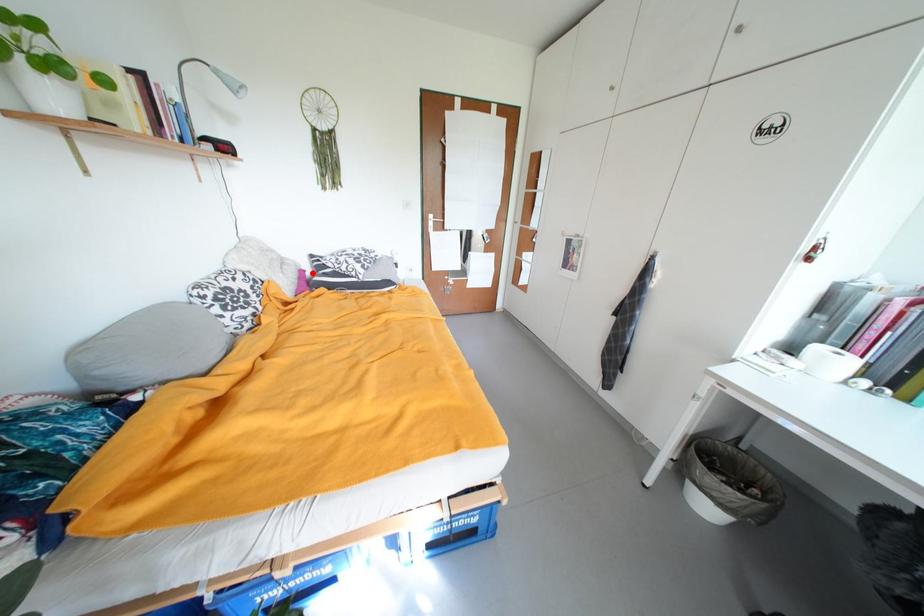
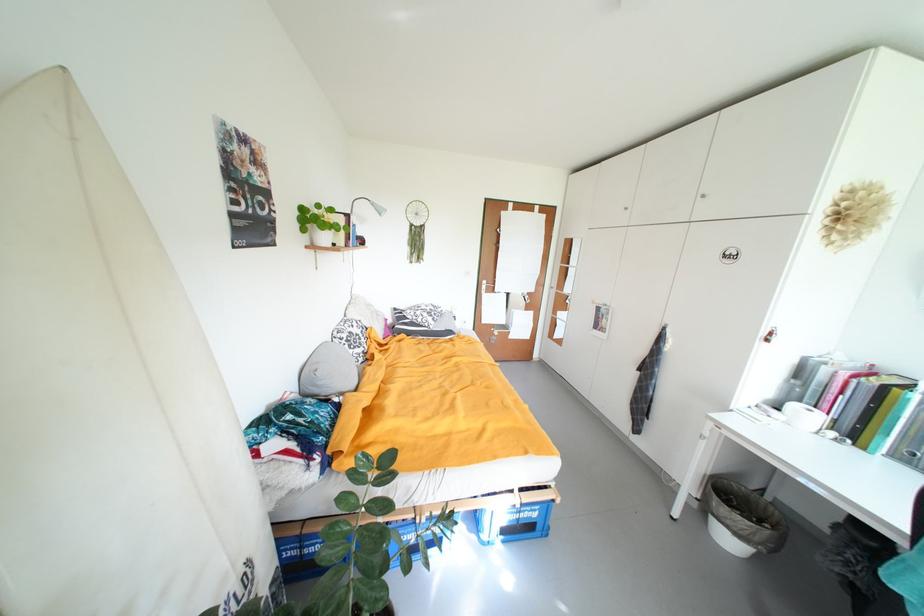
The point at the highlighted location is marked in the first image. Where is the corresponding point in the second image?

(394, 322)